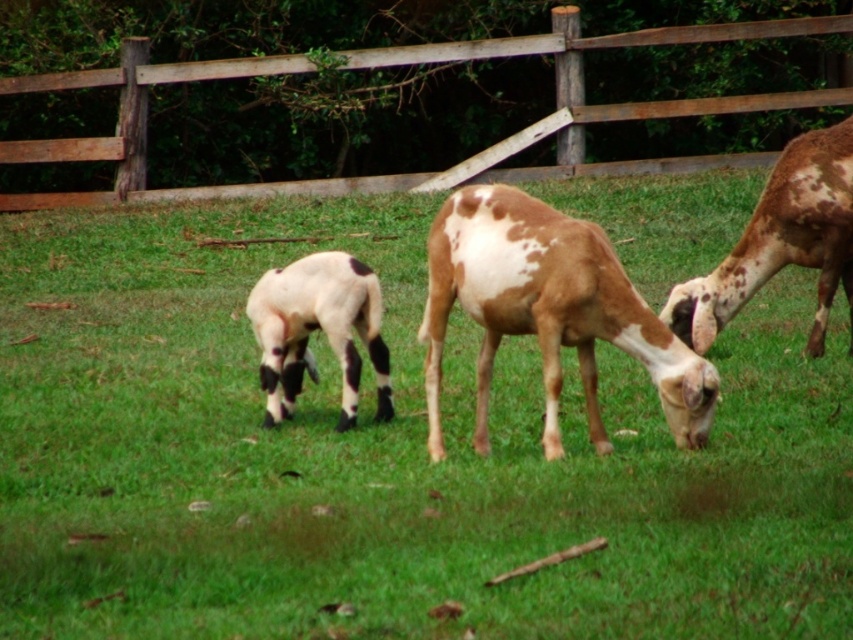
Question: Which point appears closest to the camera in this image?

Choices:
 (A) (537, 211)
 (B) (84, 317)
 (C) (761, 211)
 (D) (383, 401)

Answer: (A)

Question: Is green grassy at center to the right of speckled fur goat at center from the viewer's perspective?

Choices:
 (A) yes
 (B) no

Answer: (B)

Question: Where is speckled fur goat at center located in relation to white woolen goat at center in the image?

Choices:
 (A) right
 (B) left

Answer: (A)

Question: Which object is farther from the camera taking this photo?

Choices:
 (A) speckled fur goat at center
 (B) brown and white spotted goat at center
 (C) brown wooden fence at upper center

Answer: (C)

Question: Which point appears farthest from the camera in this image?

Choices:
 (A) (271, 381)
 (B) (839, 100)
 (C) (387, 244)

Answer: (B)

Question: Is green grassy at center bigger than speckled fur goat at center?

Choices:
 (A) no
 (B) yes

Answer: (B)